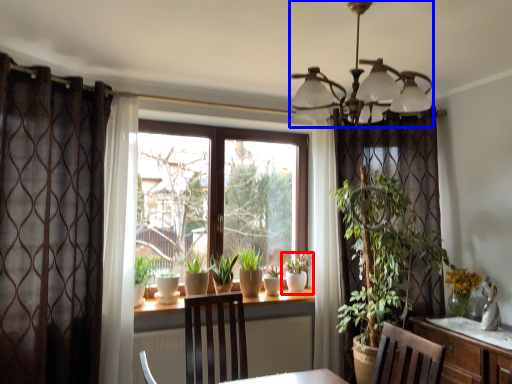
Question: Which object is further to the camera taking this photo, houseplant (highlighted by a red box) or light fixture (highlighted by a blue box)?

Choices:
 (A) houseplant
 (B) light fixture

Answer: (A)